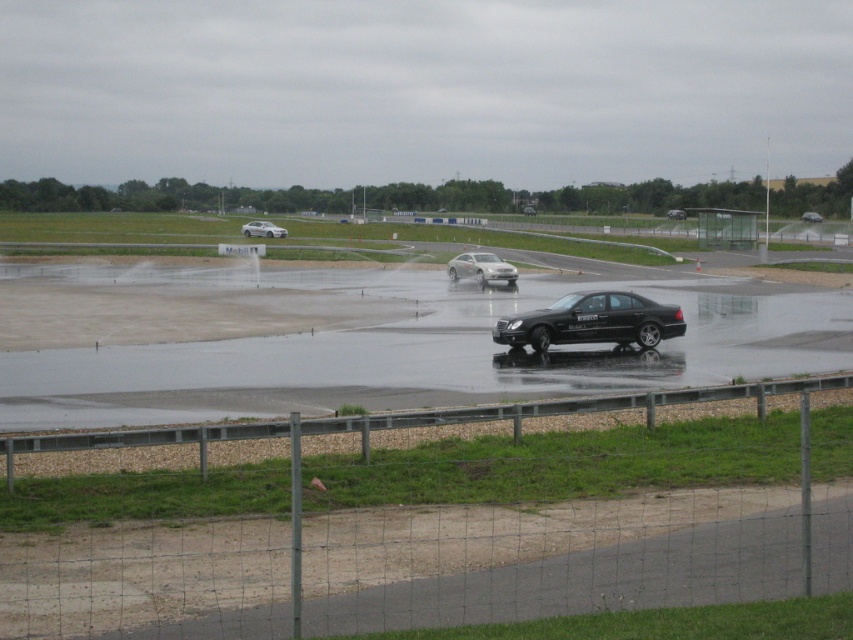
Question: Which object is positioned closest to the shiny silver sedan at center?

Choices:
 (A) metallic silver sedan at center
 (B) satin silver sedan at left

Answer: (A)

Question: Which of these objects is positioned closest to the black matte sedan at center?

Choices:
 (A) metallic silver sedan at center
 (B) satin silver sedan at center
 (C) satin silver sedan at left
 (D) shiny silver sedan at center

Answer: (B)

Question: Among these objects, which one is farthest from the camera?

Choices:
 (A) satin silver sedan at left
 (B) black matte sedan at center

Answer: (A)

Question: Can you confirm if satin silver sedan at center is bigger than satin silver sedan at left?

Choices:
 (A) no
 (B) yes

Answer: (A)

Question: In this image, where is black matte sedan at center located relative to satin silver sedan at left?

Choices:
 (A) left
 (B) right

Answer: (B)

Question: Where is black matte sedan at center located in relation to shiny silver sedan at center in the image?

Choices:
 (A) below
 (B) above

Answer: (A)